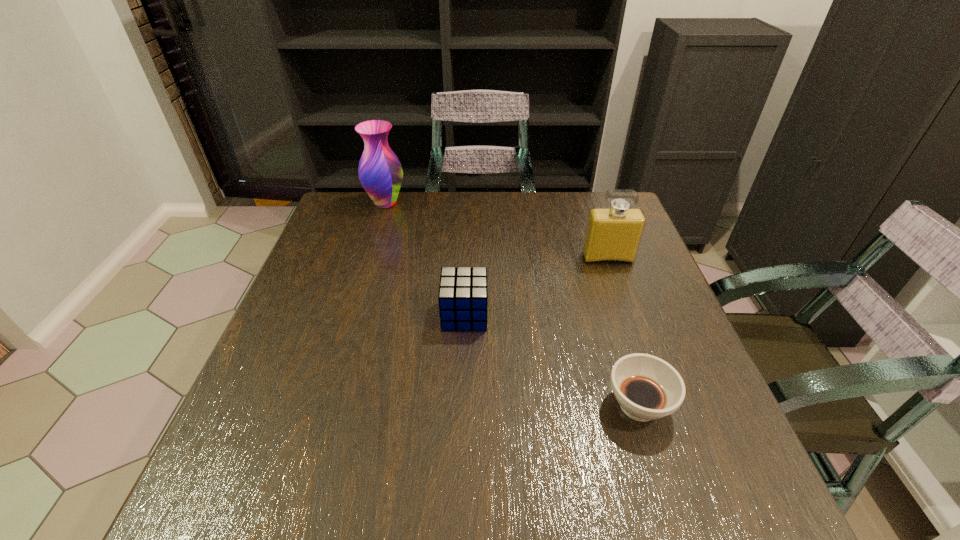
Find the location of a particular element. vacant region located 0.140m on the back of the cube is located at coordinates (467, 262).

Locate an element on the screen. The image size is (960, 540). vacant space located 0.390m on the back of the soup bowl is located at coordinates (592, 256).

Identify the location of object present at the far edge. The width and height of the screenshot is (960, 540). (380, 172).

Where is `object that is at the left edge`? The image size is (960, 540). object that is at the left edge is located at coordinates (380, 172).

Where is `perfume situated at the right edge`? perfume situated at the right edge is located at coordinates 613,234.

You are a GUI agent. You are given a task and a screenshot of the screen. Output one action in this format:
    pyautogui.click(x=<x>, y=<y>)
    Task: Click on the soup bowl at the right edge
    
    Given the screenshot: What is the action you would take?
    pyautogui.click(x=647, y=388)

Locate an element on the screen. object that is at the far left corner is located at coordinates (380, 172).

Where is `blank space at the far edge of the desktop`? Image resolution: width=960 pixels, height=540 pixels. blank space at the far edge of the desktop is located at coordinates (471, 202).

The width and height of the screenshot is (960, 540). What are the coordinates of `vacant space at the near edge of the desktop` in the screenshot? It's located at (400, 477).

In the image, there is a desktop. Where is `vacant space at the left edge`? vacant space at the left edge is located at coordinates (322, 249).